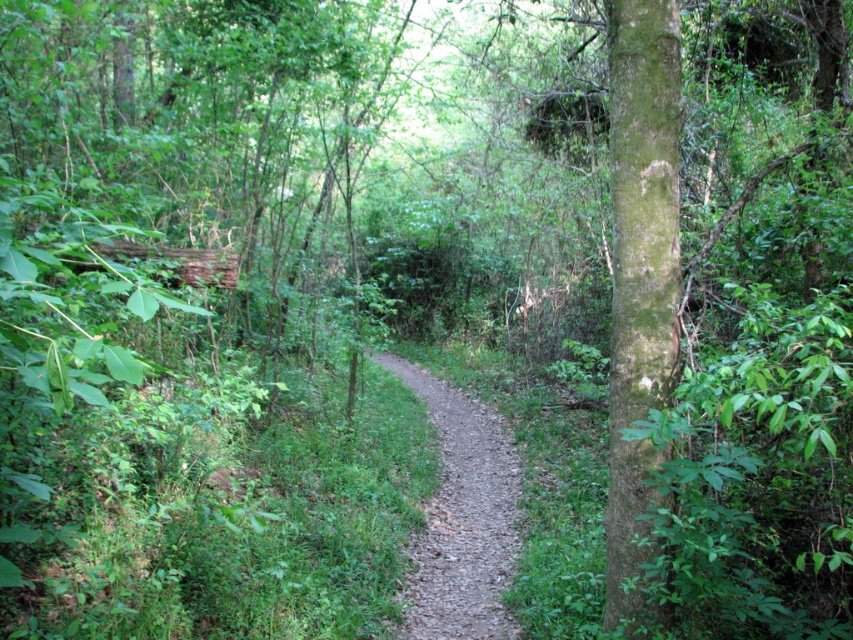
You are a hiker trying to navigate the narrow dirt path at center in the forest. There is a green mossy bark tree at right nearby. Can you estimate whether the tree takes up more space than the path?

The green mossy bark tree at right occupies less space than the dirt path at center, so the tree takes up less space than the path.

You are a hiker navigating a narrow dirt path in a forest. You notice two points marked on the path. The first point is at coordinates point (x=676, y=289) and the second is at point (x=457, y=598). Which point is closer to you as you stand on the path?

Point (x=676, y=289) is closer to the camera than point (x=457, y=598), so the first point is closer to you.

You are a hiker carrying a backpack and need to reach a cabin located 5 meters ahead on the path. There is a green mossy bark tree at right blocking your path. Can you walk around it on the right side?

The green mossy bark tree at right is 3.71 meters away from you. Since the cabin is 5 meters ahead, you can walk around the tree on the right side as the distance to the cabin is greater than the distance to the tree.